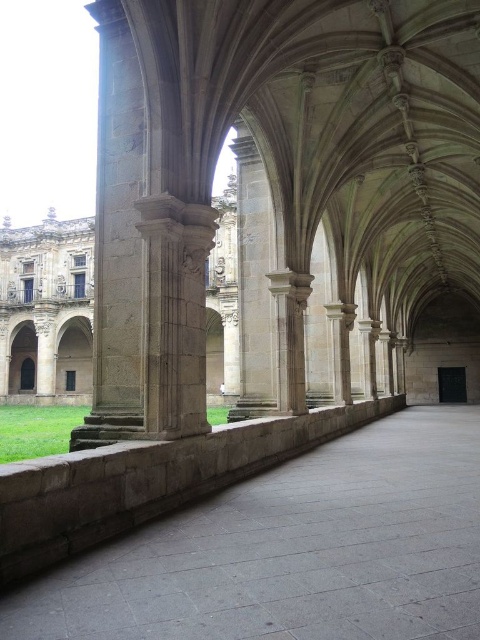
You are an architect examining the historical building. You need to determine the spatial relationship between the brown stone ledge at lower left and the brown stone column at center. From your vantage point, which object is closer to you?

The brown stone ledge at lower left is in front of the brown stone column at center, meaning it is closer to you.

You are an architect examining the Gothic walkway. You notice both the brown stone column at center and the smooth stone pillar at center. Which of these two structures is positioned lower in the image?

The brown stone column at center is located below the smooth stone pillar at center, so it is positioned lower in the image.